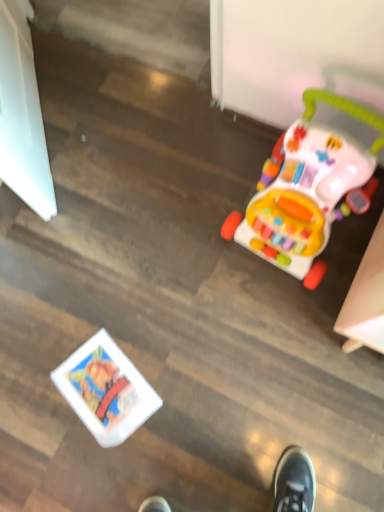
Question: Could you tell me if white glossy book at lower left, the 1th toy from the bottom, is turned towards multicolored plastic walker at right, the first toy from the right?

Choices:
 (A) yes
 (B) no

Answer: (B)

Question: Would you say multicolored plastic walker at right, positioned as the first toy in top-to-bottom order, is part of white glossy book at lower left, the second toy from the top,'s contents?

Choices:
 (A) yes
 (B) no

Answer: (B)

Question: Is white glossy book at lower left, the 1th toy from the bottom, thinner than multicolored plastic walker at right, which appears as the 2th toy when ordered from the bottom?

Choices:
 (A) yes
 (B) no

Answer: (A)

Question: Considering the relative positions of white glossy book at lower left, the second toy from the top, and multicolored plastic walker at right, positioned as the first toy in top-to-bottom order, in the image provided, is white glossy book at lower left, the second toy from the top, to the left of multicolored plastic walker at right, positioned as the first toy in top-to-bottom order, from the viewer's perspective?

Choices:
 (A) no
 (B) yes

Answer: (B)

Question: Can you confirm if white glossy book at lower left, which is the 2th toy from right to left, is wider than multicolored plastic walker at right, which appears as the 2th toy when ordered from the bottom?

Choices:
 (A) yes
 (B) no

Answer: (B)

Question: Does white glossy book at lower left, arranged as the first toy when viewed from the left, have a lesser height compared to multicolored plastic walker at right, positioned as the first toy in top-to-bottom order?

Choices:
 (A) yes
 (B) no

Answer: (A)

Question: Can you confirm if multicolored plastic walker at right, the first toy from the right, is shorter than white glossy book at lower left, the second toy from the top?

Choices:
 (A) yes
 (B) no

Answer: (B)

Question: Is the position of multicolored plastic walker at right, positioned as the first toy in top-to-bottom order, more distant than that of white glossy book at lower left, which is the 2th toy from right to left?

Choices:
 (A) yes
 (B) no

Answer: (B)

Question: Does multicolored plastic walker at right, which appears as the 2th toy when ordered from the bottom, have a greater width compared to white glossy book at lower left, which is the 2th toy from right to left?

Choices:
 (A) no
 (B) yes

Answer: (B)

Question: From a real-world perspective, is multicolored plastic walker at right, which appears as the 2th toy when ordered from the bottom, on white glossy book at lower left, the second toy from the top?

Choices:
 (A) no
 (B) yes

Answer: (B)

Question: Is multicolored plastic walker at right, the first toy from the right, outside of white glossy book at lower left, arranged as the first toy when viewed from the left?

Choices:
 (A) yes
 (B) no

Answer: (A)

Question: Is multicolored plastic walker at right, positioned as the first toy in top-to-bottom order, bigger than white glossy book at lower left, arranged as the first toy when viewed from the left?

Choices:
 (A) no
 (B) yes

Answer: (B)

Question: From their relative heights in the image, would you say white glossy book at lower left, which is the 2th toy from right to left, is taller or shorter than multicolored plastic walker at right, positioned as the first toy in top-to-bottom order?

Choices:
 (A) short
 (B) tall

Answer: (A)